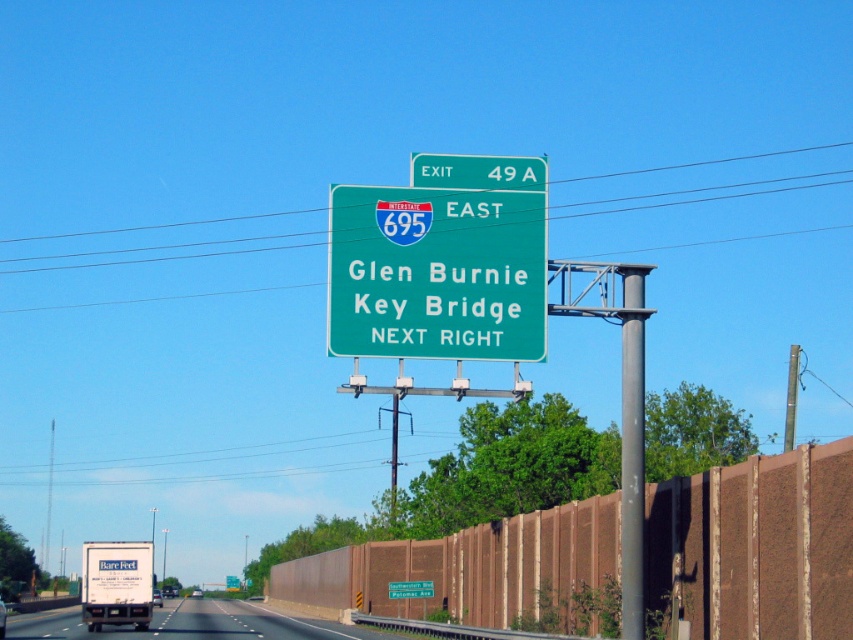
Can you confirm if gray metallic pole at center-right is bigger than green matte sign at upper center?

Indeed, gray metallic pole at center-right has a larger size compared to green matte sign at upper center.

Is gray metallic pole at center-right to the left of green matte sign at upper center from the viewer's perspective?

Incorrect, gray metallic pole at center-right is not on the left side of green matte sign at upper center.

The height and width of the screenshot is (640, 853). Identify the location of gray metallic pole at center-right. point(631,445).

Find the location of a particular element. This screenshot has width=853, height=640. gray metallic pole at center-right is located at coordinates (631, 445).

Does green matte highway sign at center come in front of black asphalt highway at center?

Yes, green matte highway sign at center is closer to the viewer.

Which is behind, point (532, 195) or point (10, 632)?

The point (10, 632) is behind.

The width and height of the screenshot is (853, 640). I want to click on green matte highway sign at center, so click(436, 273).

Which is below, green matte highway sign at center or gray metallic pole at center-right?

gray metallic pole at center-right is lower down.

How distant is green matte highway sign at center from gray metallic pole at center-right?

green matte highway sign at center and gray metallic pole at center-right are 47.94 feet apart from each other.

Which is behind, point (440, 288) or point (635, 625)?

Positioned behind is point (635, 625).

Locate an element on the screen. The height and width of the screenshot is (640, 853). green matte highway sign at center is located at coordinates (436, 273).